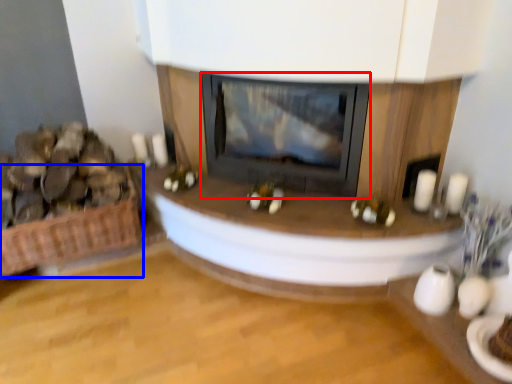
Question: Among these objects, which one is farthest to the camera, wood burning stove (highlighted by a red box) or basket (highlighted by a blue box)?

Choices:
 (A) wood burning stove
 (B) basket

Answer: (B)